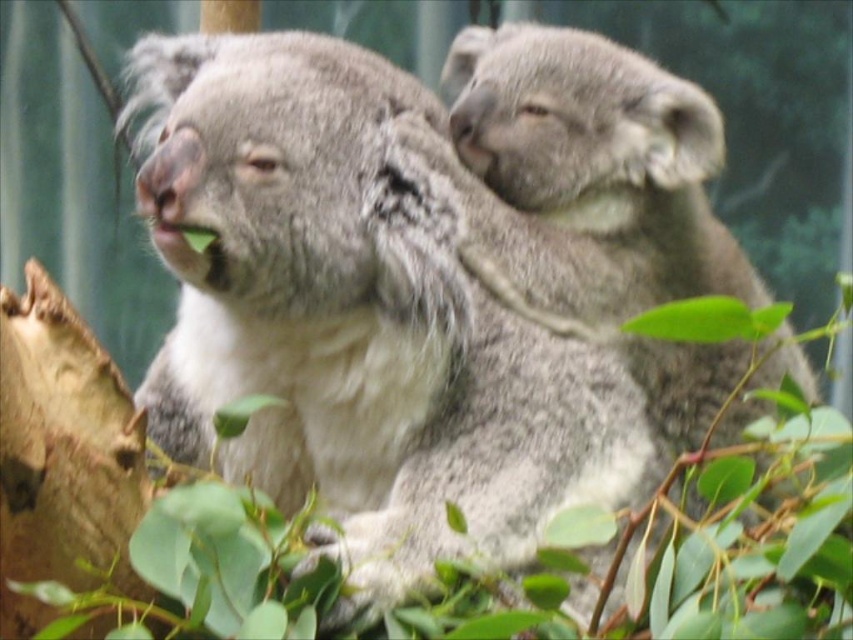
Question: Can you confirm if gray furry koala at center is wider than fuzzy gray koala at upper right?

Choices:
 (A) yes
 (B) no

Answer: (A)

Question: Which object is closer to the camera taking this photo?

Choices:
 (A) fuzzy gray koala at upper right
 (B) gray furry koala at center

Answer: (B)

Question: Which of the following is the farthest from the observer?

Choices:
 (A) (618, 115)
 (B) (291, 264)

Answer: (A)

Question: Is gray furry koala at center below fuzzy gray koala at upper right?

Choices:
 (A) no
 (B) yes

Answer: (B)

Question: Which object appears closest to the camera in this image?

Choices:
 (A) fuzzy gray koala at upper right
 (B) gray furry koala at center

Answer: (B)

Question: Is gray furry koala at center above fuzzy gray koala at upper right?

Choices:
 (A) no
 (B) yes

Answer: (A)